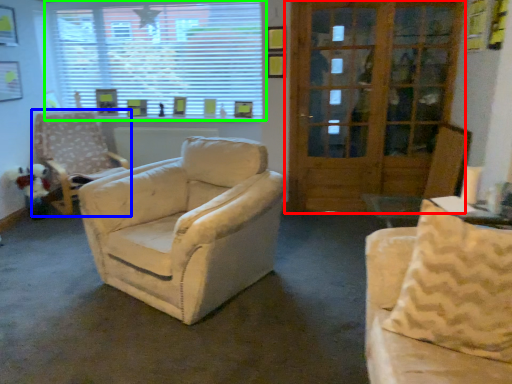
Question: Based on their relative distances, which object is farther from door (highlighted by a red box)? Choose from chair (highlighted by a blue box) and window (highlighted by a green box).

Choices:
 (A) chair
 (B) window

Answer: (A)